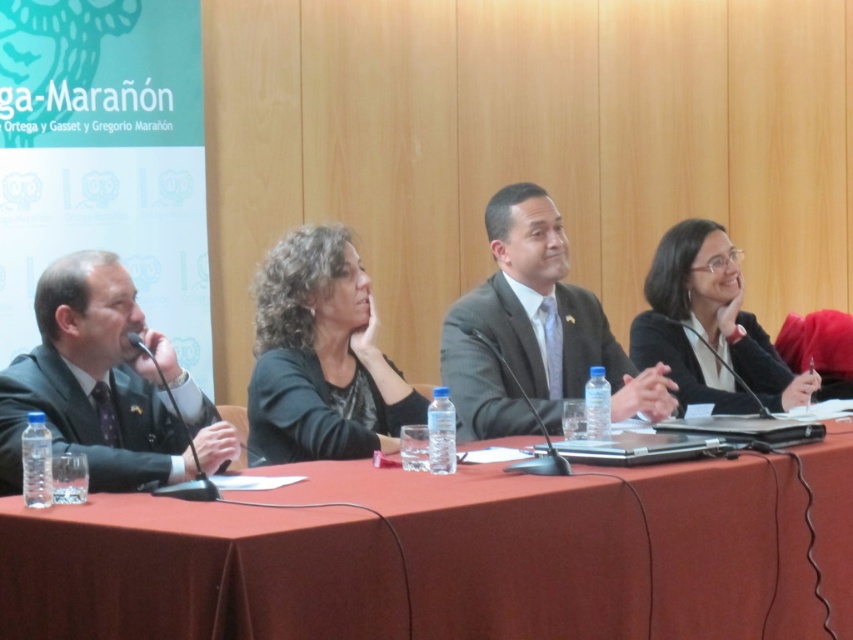
You are an event organizer arranging a panel discussion. You need to place a name tag on the table in front of the black matte jacket at center so it is visible to the audience. Where should you place it relative to the black matte business suit at center?

The black matte jacket at center is in front of the black matte business suit at center, so placing the name tag in front of the black matte jacket at center would position it closer to the audience, making it visible.

You are organizing a conference and need to place a 1.5 meter wide banner on the table. The banner must be placed between the smooth red tablecloth at center and the black matte business suit at center. Is there enough space for the banner?

The smooth red tablecloth at center has a larger width than the black matte business suit at center. However, the exact dimensions are not provided, so it is uncertain if the space between them can accommodate a 1.5 meter wide banner. Additional measurements are needed to confirm.